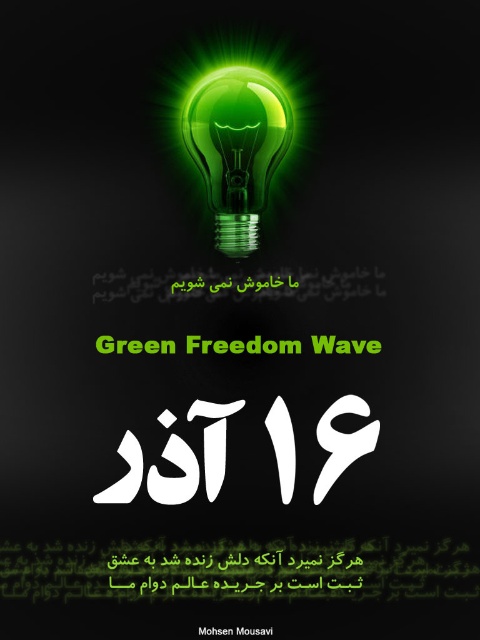
You are designing a poster for an environmental campaign and want to ensure the green glass bulb at center and the black matte text at lower center are visually balanced. Given their sizes, which object should you adjust to achieve better balance?

The green glass bulb at center is larger than the black matte text at lower center. To achieve better visual balance, you should reduce the size of the green glass bulb at center or increase the size of the black matte text at lower center.

You are an observer looking at the image. You notice the black matte text at lower center and the green matte text at center. Which text is positioned to the right of the other?

The black matte text at lower center is to the right of the green matte text at center according to the description.

You are an art curator planning to display the green glass bulb at center and the black matte text at lower center in a gallery. Based on the scene description, which object is positioned to the right when viewed from the front?

The black matte text at lower center is positioned to the right of the green glass bulb at center.